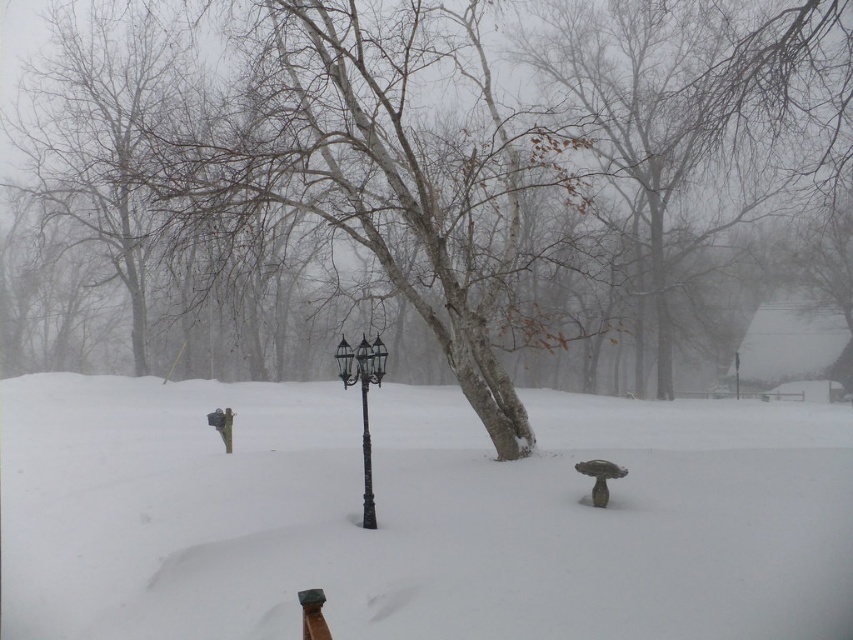
Measure the distance from smooth bark tree at center to black metal lamp post at center.

37.23 feet

In the scene shown: Can you confirm if smooth bark tree at center is wider than black metal lamp post at center?

Yes, smooth bark tree at center is wider than black metal lamp post at center.

Is point (843, 339) positioned before point (341, 371)?

That is False.

At what (x,y) coordinates should I click in order to perform the action: click on smooth bark tree at center. Please return your answer as a coordinate pair (x, y). Looking at the image, I should click on (424, 180).

Measure the distance between white powdery snow at center and black metal lamp post at center.

The distance of white powdery snow at center from black metal lamp post at center is 20.20 feet.

Who is more forward, (80, 499) or (372, 529)?

Positioned in front is point (372, 529).

Is point (24, 547) in front of point (367, 508)?

That is False.

This screenshot has height=640, width=853. I want to click on white powdery snow at center, so click(416, 515).

Between point (540, 584) and point (363, 388), which one is positioned behind?

Positioned behind is point (363, 388).

Is white powdery snow at center to the left of black polished metal pole at center from the viewer's perspective?

No, white powdery snow at center is not to the left of black polished metal pole at center.

Where is `white powdery snow at center`? The height and width of the screenshot is (640, 853). white powdery snow at center is located at coordinates (416, 515).